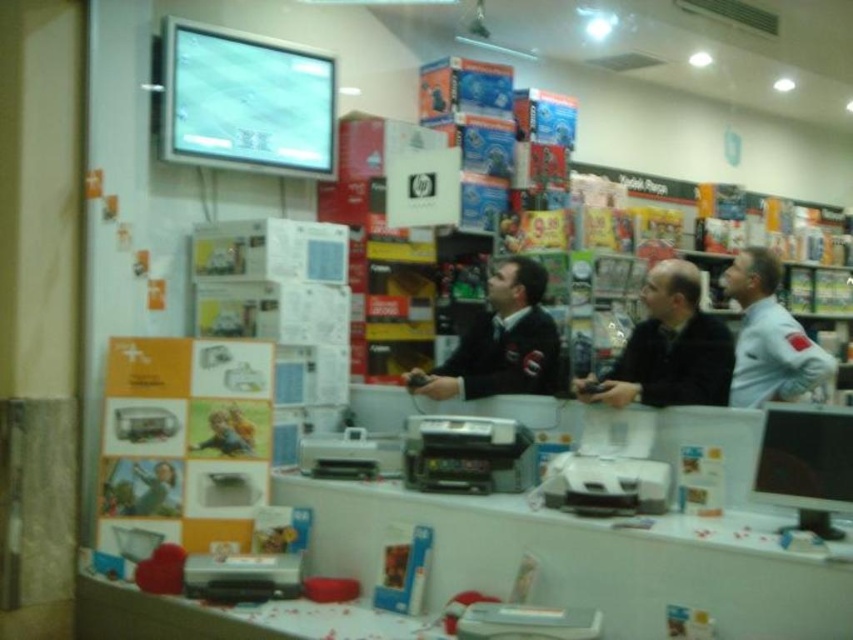
Who is positioned more to the right, black matte shirt at center or matte black monitor at center?

matte black monitor at center is more to the right.

Is point (640, 326) closer to camera compared to point (775, 465)?

No, (640, 326) is behind (775, 465).

Find the location of a particular element. Image resolution: width=853 pixels, height=640 pixels. black matte shirt at center is located at coordinates (668, 348).

Which of these two, black matte jacket at center or matte black monitor at center, stands shorter?

matte black monitor at center is shorter.

Measure the distance between point (422,380) and camera.

A distance of 3.70 meters exists between point (422,380) and camera.

Is point (486, 396) more distant than point (814, 490)?

Yes, it is.

Where is `black matte jacket at center`? The image size is (853, 640). black matte jacket at center is located at coordinates point(502,342).

Can you confirm if black matte shirt at center is positioned below white uniform at center?

Yes, black matte shirt at center is below white uniform at center.

Does point (659, 384) lie in front of point (751, 285)?

That is True.

Which is in front, point (664, 296) or point (772, 348)?

Point (664, 296) is more forward.

Where is `black matte shirt at center`? This screenshot has width=853, height=640. black matte shirt at center is located at coordinates (668, 348).